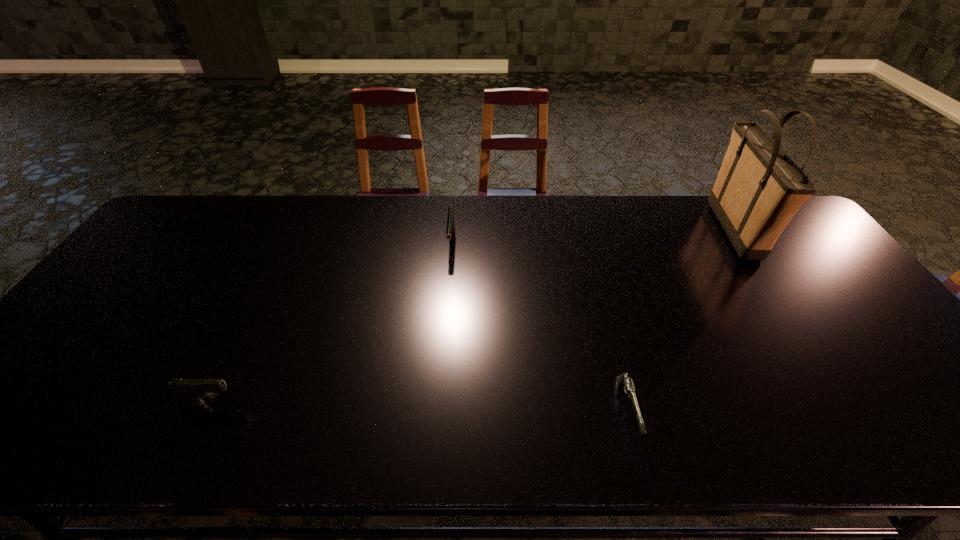
At what (x,y) coordinates should I click in order to perform the action: click on empty space between the leftmost pistol and the second pistol from right to left. Please return your answer as a coordinate pair (x, y). The height and width of the screenshot is (540, 960). Looking at the image, I should click on (331, 323).

Identify the location of free spot between the second object from right to left and the tallest object. Image resolution: width=960 pixels, height=540 pixels. (681, 321).

Locate an element on the screen. Image resolution: width=960 pixels, height=540 pixels. free space between the tallest object and the leftmost pistol is located at coordinates tap(471, 317).

Where is `free spot between the second object from left to right and the leftmost pistol`? The image size is (960, 540). free spot between the second object from left to right and the leftmost pistol is located at coordinates (331, 323).

You are a GUI agent. You are given a task and a screenshot of the screen. Output one action in this format:
    pyautogui.click(x=<x>, y=<y>)
    Task: Click on the free space between the leftmost pistol and the shortest object
    This screenshot has width=960, height=540.
    Given the screenshot: What is the action you would take?
    pyautogui.click(x=419, y=407)

The image size is (960, 540). Identify the location of vacant space that is in between the leftmost object and the second object from left to right. (331, 323).

I want to click on vacant area that lies between the shortest pistol and the second pistol from right to left, so [x=540, y=327].

What are the coordinates of `free spot between the leftmost object and the second pistol from left to right` in the screenshot? It's located at (331, 323).

Where is `object that is the third nearest to the shortest pistol`? object that is the third nearest to the shortest pistol is located at coordinates coord(190,391).

Choose which object is the second nearest neighbor to the tallest object. Please provide its 2D coordinates. Your answer should be formatted as a tuple, i.e. [(x, y)], where the tuple contains the x and y coordinates of a point satisfying the conditions above.

[(450, 229)]